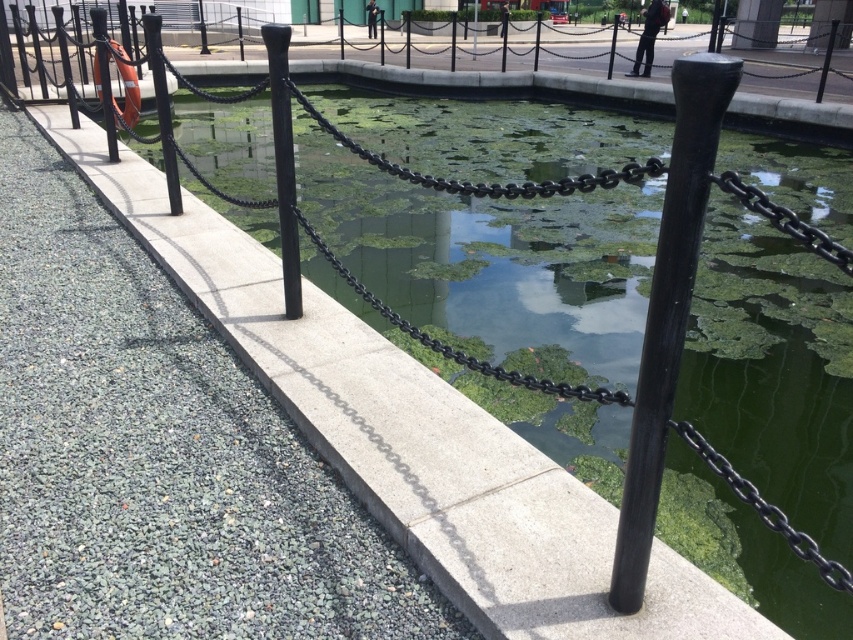
You are a city planner assessing the waterfront pathway. You notice two black metal poles along the fence. Which pole, the black polished metal pole at center or the black metal pole at left, is narrower?

The black polished metal pole at center has a lesser width compared to the black metal pole at left, so it is narrower.